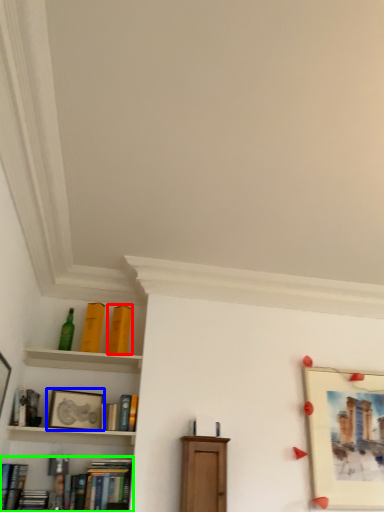
Question: Estimate the real-world distances between objects in this image. Which object is closer to book (highlighted by a red box), picture frame (highlighted by a blue box) or book (highlighted by a green box)?

Choices:
 (A) picture frame
 (B) book

Answer: (A)